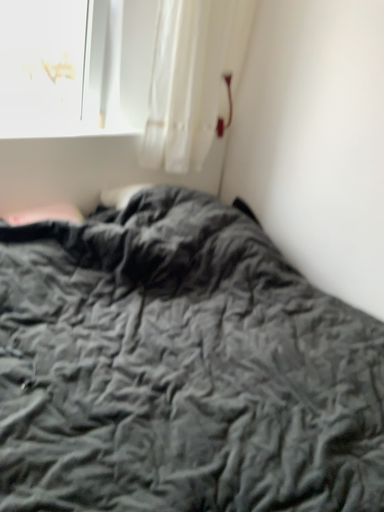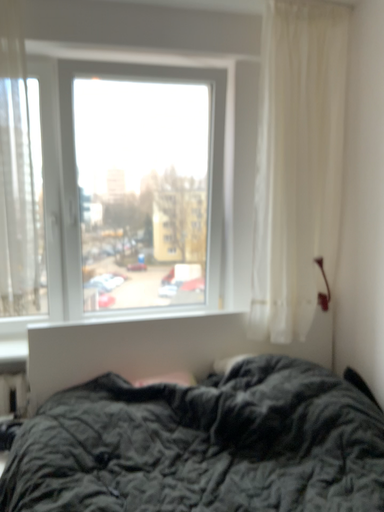
Question: Which way did the camera rotate in the video?

Choices:
 (A) rotated left
 (B) rotated right

Answer: (A)